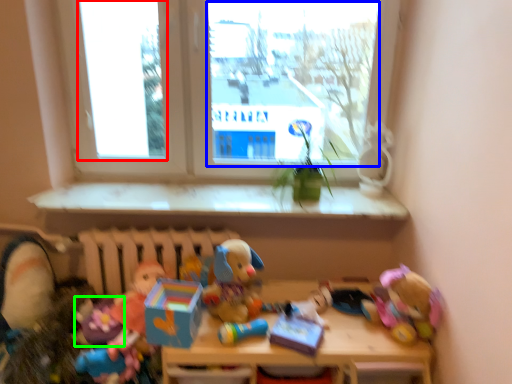
Question: Considering the real-world distances, which object is closest to window screen (highlighted by a red box)? window screen (highlighted by a blue box) or toy (highlighted by a green box).

Choices:
 (A) window screen
 (B) toy

Answer: (A)